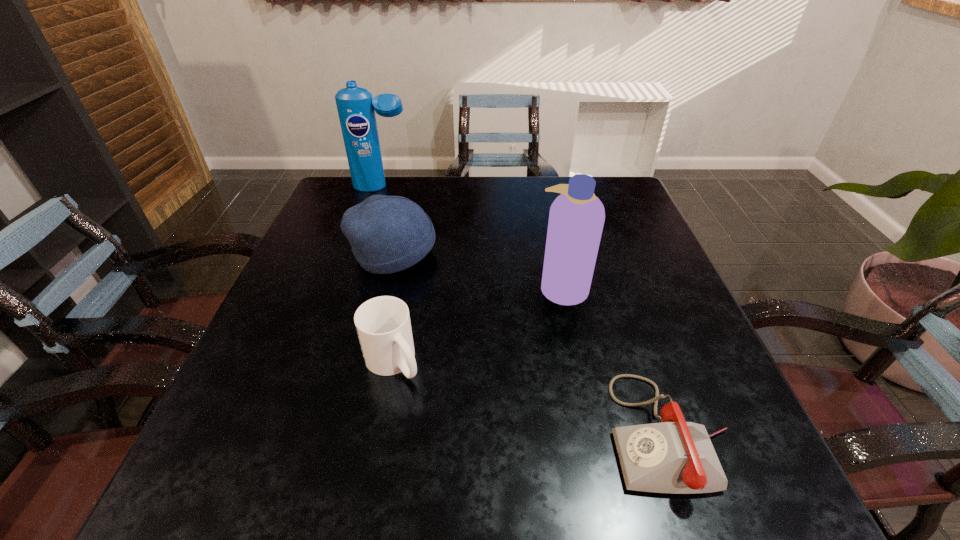
This screenshot has width=960, height=540. I want to click on the farthest object, so [356, 107].

You are a GUI agent. You are given a task and a screenshot of the screen. Output one action in this format:
    pyautogui.click(x=<x>, y=<y>)
    Task: Click on the farther shampoo
    
    Given the screenshot: What is the action you would take?
    (356, 107)

Identify the location of the right shampoo. Image resolution: width=960 pixels, height=540 pixels. (576, 219).

Image resolution: width=960 pixels, height=540 pixels. What are the coordinates of `the third shortest object` in the screenshot? It's located at (388, 234).

I want to click on the second shortest object, so click(383, 325).

Locate an element on the screen. This screenshot has width=960, height=540. the shortest object is located at coordinates (677, 457).

The height and width of the screenshot is (540, 960). Find the location of `free region located on the right of the farther shampoo`. free region located on the right of the farther shampoo is located at coordinates (486, 187).

Image resolution: width=960 pixels, height=540 pixels. What are the coordinates of `blank space located 0.240m on the front of the right shampoo` in the screenshot? It's located at (588, 409).

The width and height of the screenshot is (960, 540). I want to click on free point located on the left of the skullcap, so click(x=306, y=253).

Where is `free space located 0.130m on the right of the mug`? The width and height of the screenshot is (960, 540). free space located 0.130m on the right of the mug is located at coordinates pyautogui.click(x=492, y=362).